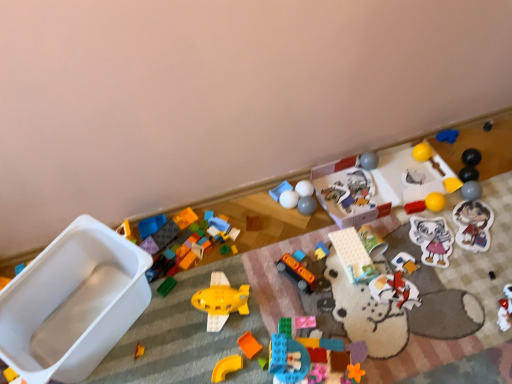
Find the location of `vacant space to the right of white matte balls at center, the ninth toy viewed from the left`. vacant space to the right of white matte balls at center, the ninth toy viewed from the left is located at coordinates (337, 199).